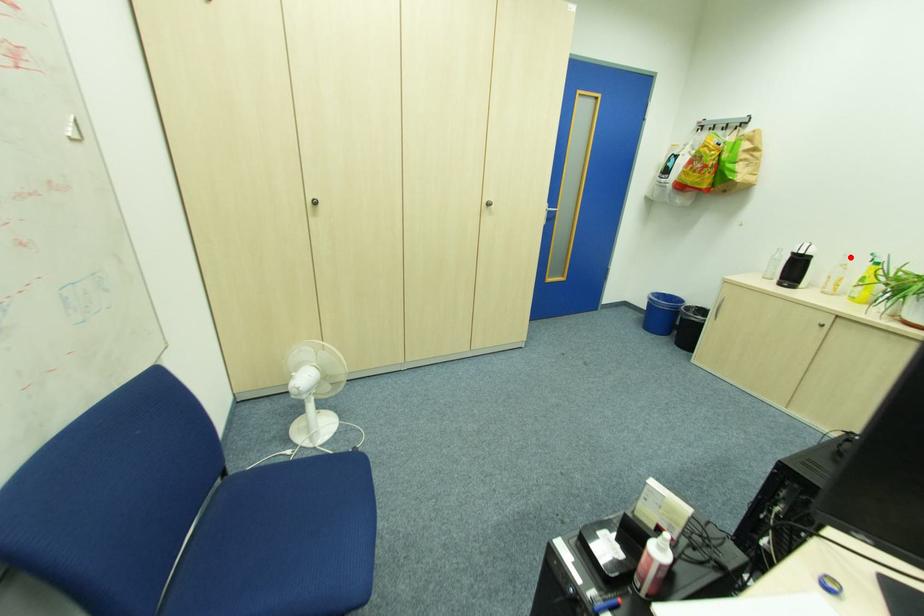
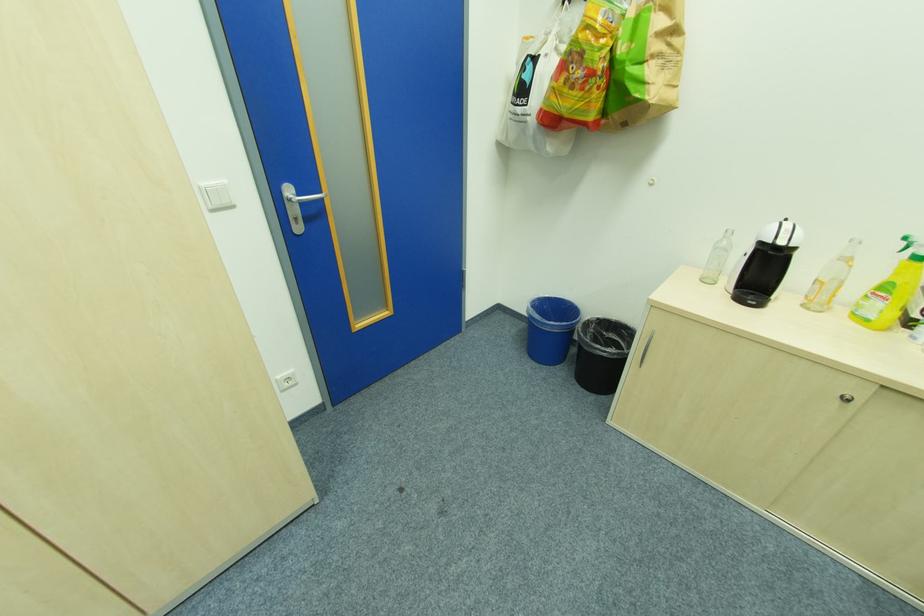
In the second image, find the point that corresponds to the highlighted location in the first image.

(855, 243)